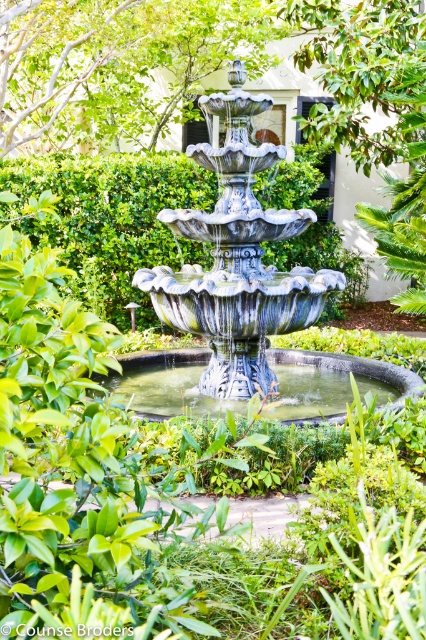
Consider the image. Can you confirm if stone fountain at center is bigger than metallic fountain at center?

Indeed, stone fountain at center has a larger size compared to metallic fountain at center.

Can you confirm if stone fountain at center is positioned below metallic fountain at center?

Incorrect, stone fountain at center is not positioned below metallic fountain at center.

Who is more forward, [213,381] or [141,413]?

Point [141,413] is in front.

Locate an element on the screen. This screenshot has height=640, width=426. stone fountain at center is located at coordinates (233, 266).

Between green leafy hedge at center and metallic fountain at center, which one has more height?

green leafy hedge at center is taller.

Is green leafy hedge at center closer to the viewer compared to metallic fountain at center?

No, it is not.

Measure the distance between point (333, 250) and camera.

41.58 feet

Where is `green leafy hedge at center`? The width and height of the screenshot is (426, 640). green leafy hedge at center is located at coordinates (112, 220).

Does stone fountain at center have a larger size compared to green leafy hedge at center?

Yes, stone fountain at center is bigger than green leafy hedge at center.

Is point (147, 403) closer to viewer compared to point (143, 220)?

Yes.

Image resolution: width=426 pixels, height=640 pixels. I want to click on stone fountain at center, so click(x=233, y=266).